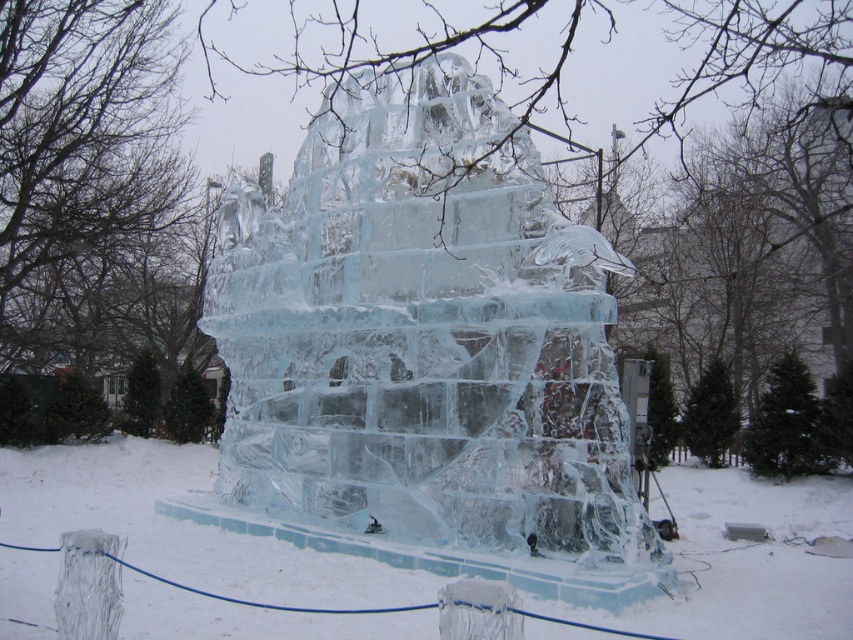
You are an artist planning to place a 1.5 meter wide sculpture base in the center of the clear ice sculpture at center and transparent ice sculpture at center. Which sculpture can accommodate the base without exceeding its width?

The transparent ice sculpture at center can accommodate the 1.5 meter wide sculpture base since its width is greater than the clear ice sculpture at center.

You are an ice sculptor who wants to place a new ice block on top of the existing structure. Based on the image, which ice sculpture at center should you place it on top of, the clear ice sculpture at center or the transparent ice sculpture at center?

The clear ice sculpture at center is positioned over the transparent ice sculpture at center, so you should place the new ice block on top of the clear ice sculpture at center.